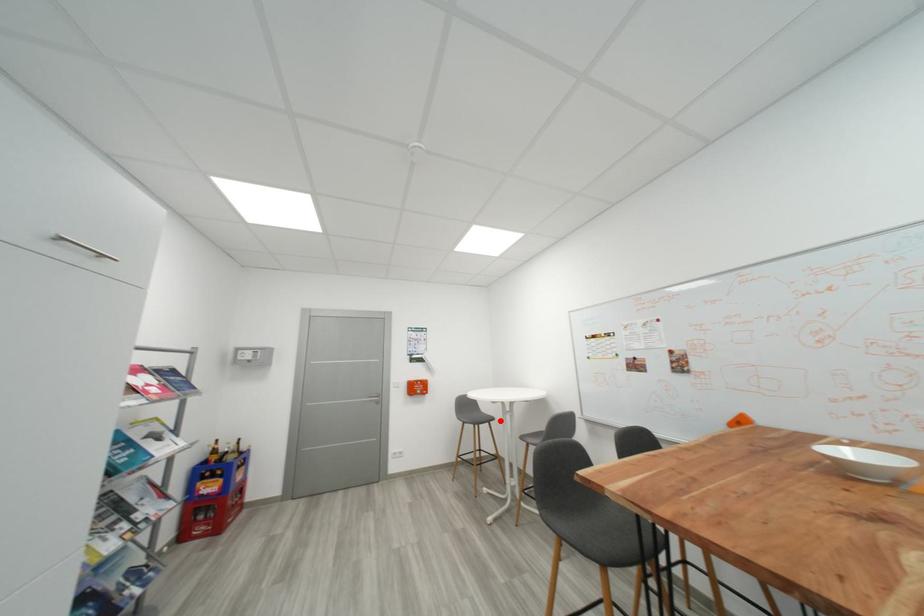
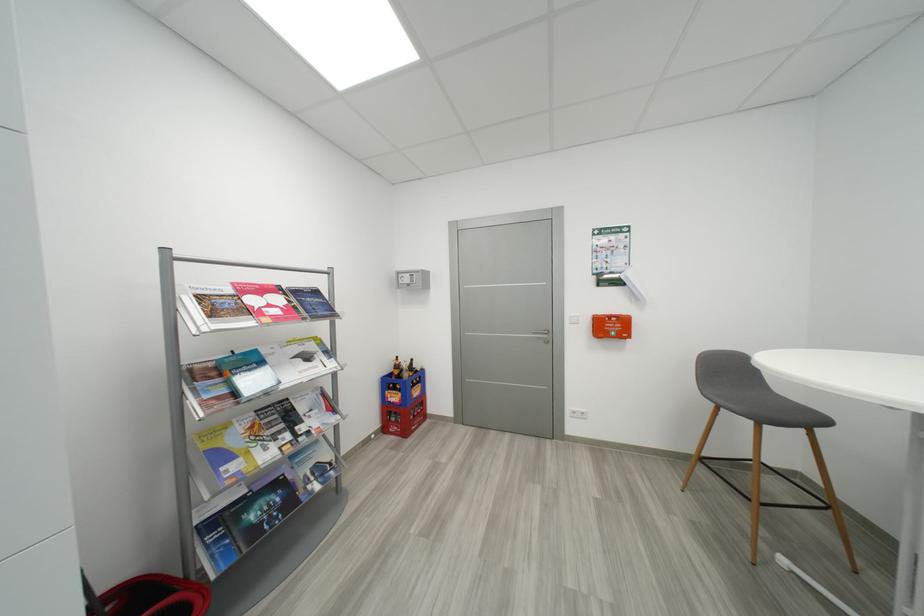
Question: A red point is marked in image1. In image2, is the corresponding 3D point closer to the camera or farther? Reply with the corresponding letter.

Choices:
 (A) The corresponding 3D point is closer.
 (B) The corresponding 3D point is farther.

Answer: (A)